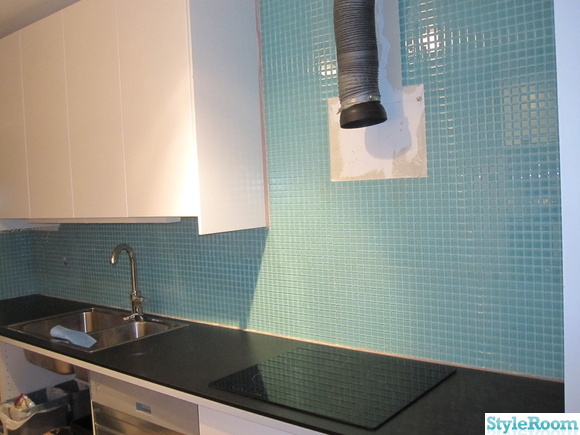
Find the location of a particular element. The height and width of the screenshot is (435, 580). kitchen is located at coordinates (67, 425).